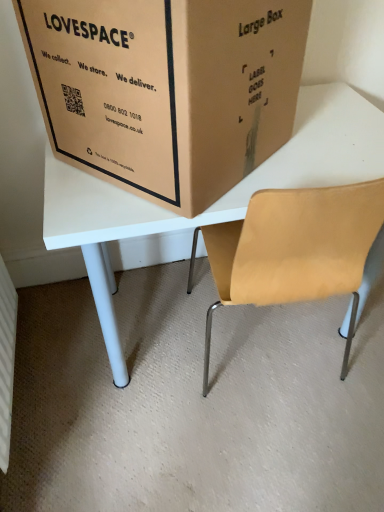
Question: Is matte white table at center turned away from brown cardboard box at upper center?

Choices:
 (A) yes
 (B) no

Answer: (B)

Question: Is matte white table at center shorter than brown cardboard box at upper center?

Choices:
 (A) no
 (B) yes

Answer: (A)

Question: From the image's perspective, is matte white table at center on top of brown cardboard box at upper center?

Choices:
 (A) no
 (B) yes

Answer: (A)

Question: Is matte white table at center aimed at brown cardboard box at upper center?

Choices:
 (A) yes
 (B) no

Answer: (B)

Question: Can you confirm if matte white table at center is wider than brown cardboard box at upper center?

Choices:
 (A) no
 (B) yes

Answer: (B)

Question: Can you confirm if matte white table at center is thinner than brown cardboard box at upper center?

Choices:
 (A) no
 (B) yes

Answer: (A)

Question: Is brown cardboard box at upper center positioned with its back to matte white table at center?

Choices:
 (A) yes
 (B) no

Answer: (B)

Question: Does brown cardboard box at upper center have a greater width compared to matte white table at center?

Choices:
 (A) no
 (B) yes

Answer: (A)

Question: Does brown cardboard box at upper center have a larger size compared to matte white table at center?

Choices:
 (A) yes
 (B) no

Answer: (B)

Question: Would you say brown cardboard box at upper center is outside matte white table at center?

Choices:
 (A) no
 (B) yes

Answer: (B)

Question: Is brown cardboard box at upper center further to the viewer compared to matte white table at center?

Choices:
 (A) yes
 (B) no

Answer: (B)

Question: Is brown cardboard box at upper center far away from matte white table at center?

Choices:
 (A) no
 (B) yes

Answer: (A)

Question: Is brown cardboard box at upper center in front of or behind matte white table at center in the image?

Choices:
 (A) behind
 (B) front

Answer: (B)